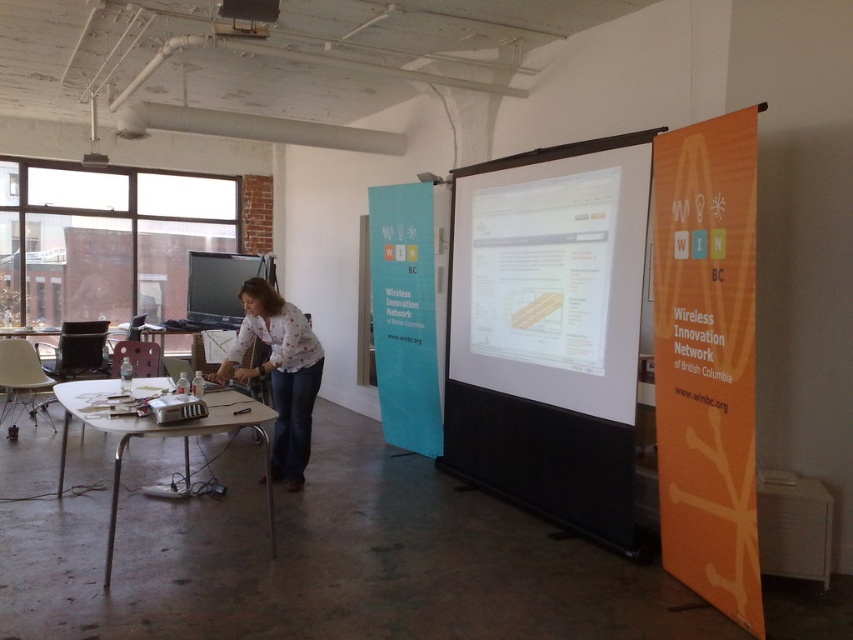
What do you see at coordinates (279, 372) in the screenshot? I see `white printed shirt at center` at bounding box center [279, 372].

Which is above, white printed shirt at center or matte black monitor at center?

matte black monitor at center is above.

Measure the distance between white printed shirt at center and camera.

They are 4.25 meters apart.

What are the coordinates of `white printed shirt at center` in the screenshot? It's located at (279, 372).

Does white printed shirt at center have a greater height compared to white glossy table at lower left?

Yes.

Between point (274, 420) and point (224, 422), which one is positioned in front?

Positioned in front is point (224, 422).

Does point (289, 472) come behind point (248, 417)?

That is True.

Locate an element on the screen. Image resolution: width=853 pixels, height=640 pixels. white printed shirt at center is located at coordinates (279, 372).

Is point (747, 131) farther from viewer compared to point (64, 467)?

No, it is in front of (64, 467).

Which of these two, orange paper at right or white glossy table at lower left, stands shorter?

Standing shorter between the two is white glossy table at lower left.

Who is more distant from viewer, (666, 307) or (67, 404)?

Point (67, 404)

Where is `orange paper at right`? Image resolution: width=853 pixels, height=640 pixels. orange paper at right is located at coordinates (706, 358).